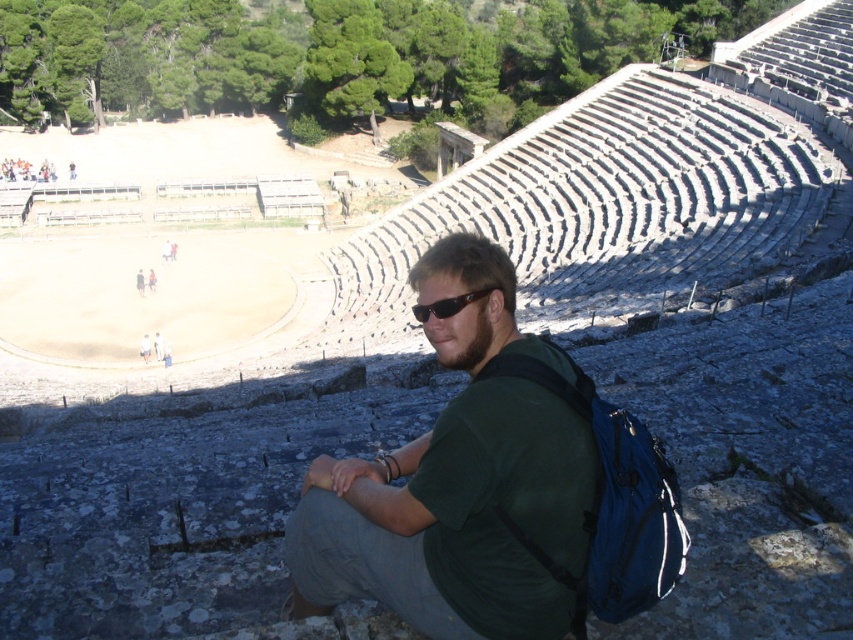
Question: Estimate the real-world distances between objects in this image. Which object is farther from the blue fabric backpack at center?

Choices:
 (A) black plastic sunglasses at center
 (B) green fabric shirt at center

Answer: (A)

Question: Which point appears closest to the camera in this image?

Choices:
 (A) (618, 564)
 (B) (457, 556)
 (C) (451, 314)

Answer: (A)

Question: Is blue fabric backpack at center wider than black plastic sunglasses at center?

Choices:
 (A) yes
 (B) no

Answer: (B)

Question: Among these points, which one is farthest from the camera?

Choices:
 (A) (454, 307)
 (B) (585, 580)

Answer: (A)

Question: Can you confirm if green fabric shirt at center is wider than black plastic sunglasses at center?

Choices:
 (A) no
 (B) yes

Answer: (B)

Question: Is green fabric shirt at center smaller than black plastic sunglasses at center?

Choices:
 (A) no
 (B) yes

Answer: (A)